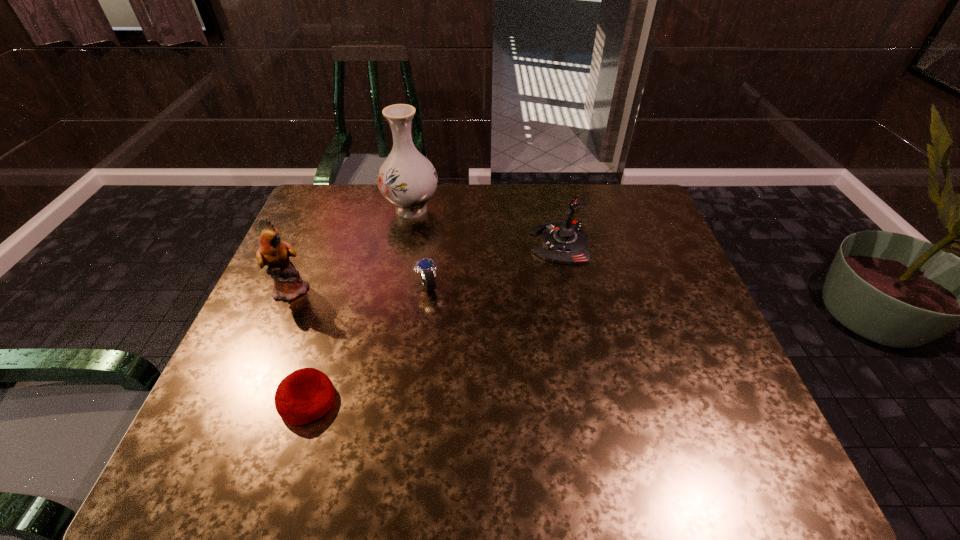
The image size is (960, 540). Find the location of `free spot between the beanbag and the tallest object`. free spot between the beanbag and the tallest object is located at coordinates (359, 305).

Identify the location of free spot between the leftmost object and the beanbag. The width and height of the screenshot is (960, 540). (300, 345).

Where is `vacant space that is in between the vase and the watch`? vacant space that is in between the vase and the watch is located at coordinates (420, 247).

At what (x,y) coordinates should I click in order to perform the action: click on empty space that is in between the third shortest object and the beanbag. Please return your answer as a coordinate pair (x, y). The height and width of the screenshot is (540, 960). Looking at the image, I should click on (434, 322).

The image size is (960, 540). What are the coordinates of `object that ranks as the second closest to the leftmost object` in the screenshot? It's located at (407, 179).

The image size is (960, 540). What are the coordinates of `object that is the third closest one to the vase` in the screenshot? It's located at pos(564,241).

This screenshot has width=960, height=540. In order to click on vacant space that satisfies the following two spatial constraints: 1. on the front side of the vase; 2. on the front-facing side of the leftmost object in this screenshot , I will do `click(396, 289)`.